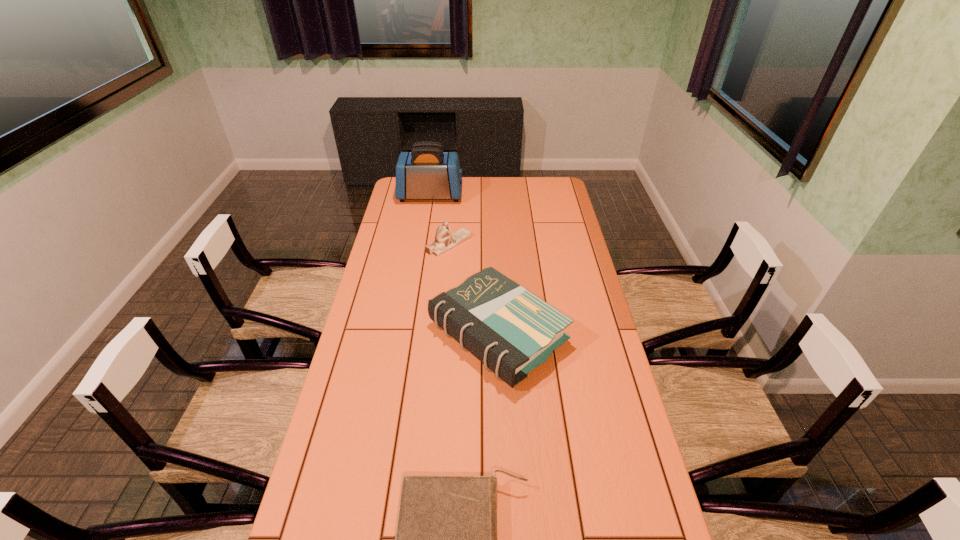
Image resolution: width=960 pixels, height=540 pixels. What are the coordinates of `object at the right edge` in the screenshot? It's located at (510, 330).

The height and width of the screenshot is (540, 960). I want to click on object located at the far left corner, so click(x=426, y=172).

In the image, there is a desktop. Identify the location of blank space at the left edge. The height and width of the screenshot is (540, 960). (413, 206).

Locate an element on the screen. The width and height of the screenshot is (960, 540). blank space at the right edge is located at coordinates (609, 345).

Image resolution: width=960 pixels, height=540 pixels. Identify the location of vacant area between the figurine and the toaster. (440, 219).

The width and height of the screenshot is (960, 540). What are the coordinates of `free spot between the second farthest object and the toaster` in the screenshot? It's located at (440, 219).

I want to click on vacant area that lies between the figurine and the farthest object, so click(x=440, y=219).

Locate an element on the screen. vacant space that's between the toaster and the second farthest object is located at coordinates (440, 219).

Identify the location of object identified as the closest to the second farthest object. (510, 330).

Locate which object is the closest to the taller paperback book. Please provide its 2D coordinates. Your answer should be formatted as a tuple, i.e. [(x, y)], where the tuple contains the x and y coordinates of a point satisfying the conditions above.

[(444, 239)]